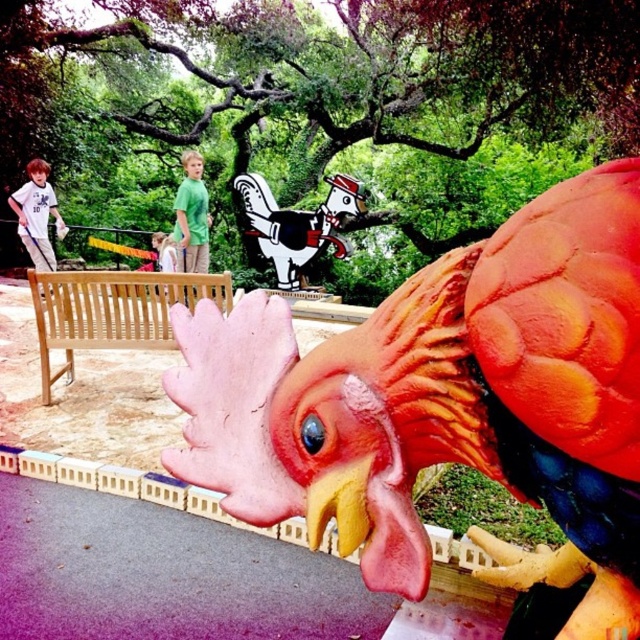
You are standing at point (193,227) and want to walk to the statue of the rooster. Is the statue of the rooster located in front of or behind point (525,396)?

The statue of the rooster is located in front of point (525,396) because point (525,396) is in front of point (193,227).

You are a child playing in the park and you see a rubber chicken at center and a green matte shirt at center. Which object is wider?

The rubber chicken at center is wider than the green matte shirt at center.

You are a parent trying to decide whether to let your child play with the rubber chicken at center and the green matte shirt at center. Considering their sizes, which one is taller?

The rubber chicken at center has a lesser height compared to the green matte shirt at center, so the green matte shirt at center is taller.